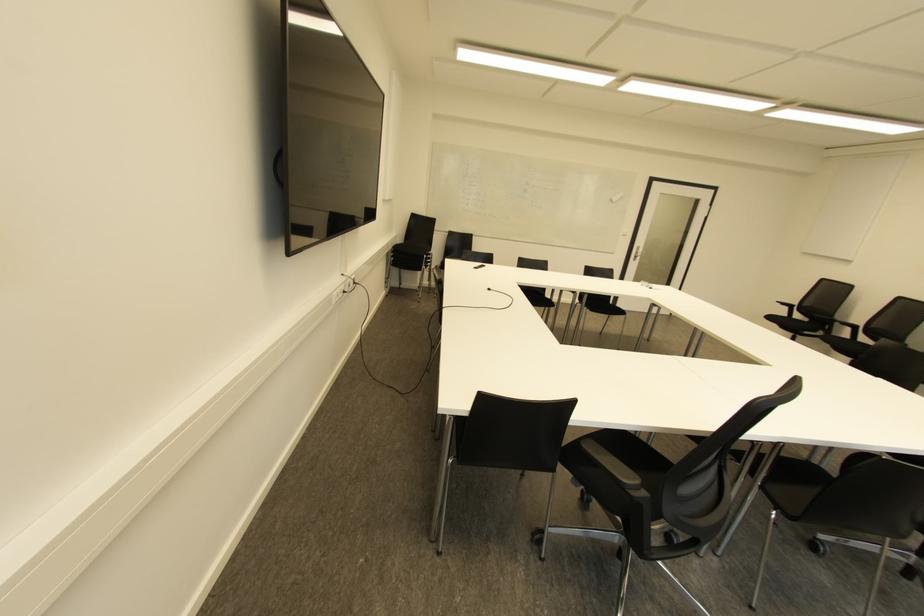
Where would you pull the door handle? Please return your answer as a coordinate pair (x, y).

(638, 253)